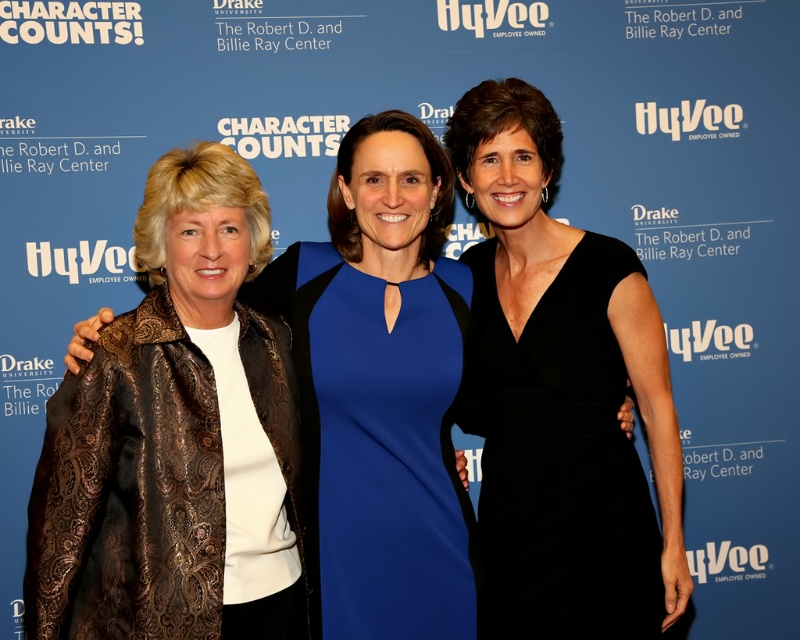
You are a photographer setting up for a group photo. You have a camera with a 24mm lens that can capture a maximum width of 1.2 meters. The black satin dress at center and bronze textured jacket at left are part of the scene. Can both items fit within the camera frame if the camera is positioned to include both?

The black satin dress at center might be wider than bronze textured jacket at left. Since the camera can capture up to 1.2 meters, if the combined width of both items is less than or equal to 1.2 meters, they could fit. However, since the black satin dress at center might be wider than the bronze textured jacket at left, their total width could exceed the camera frame limit. Further measurement is needed to confirm.

Based on the scene description, which object is bigger between the black satin dress at center and the bronze textured jacket at left?

The black satin dress at center is larger in size than the bronze textured jacket at left.

In the image of three women standing against a blue backdrop with logos, there are two points marked at coordinates point (602,492) and point (388,518). Which point is closer to the viewer?

Point (388,518) is closer to the viewer since it is in front of point (602,492) according to their spatial relationship.